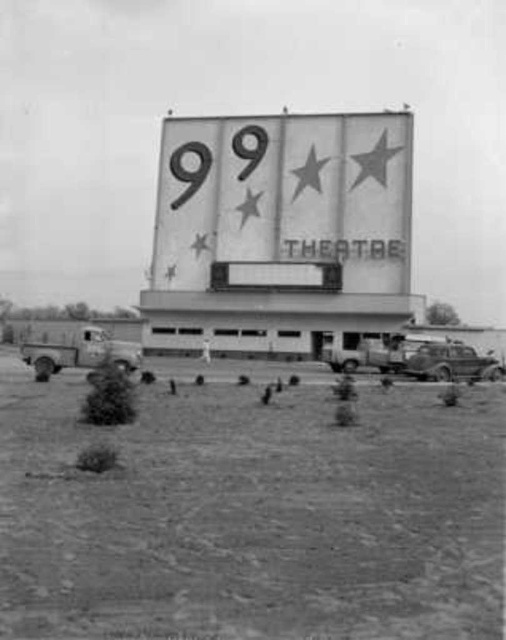
Question: Is dirt field at lower center bigger than shiny chrome sedan at right?

Choices:
 (A) no
 (B) yes

Answer: (B)

Question: Among these objects, which one is farthest from the camera?

Choices:
 (A) metallic silver sign at center
 (B) shiny chrome sedan at right

Answer: (A)

Question: Does metallic silver sign at center lie behind shiny chrome sedan at right?

Choices:
 (A) no
 (B) yes

Answer: (B)

Question: Based on their relative distances, which object is nearer to the shiny chrome sedan at right?

Choices:
 (A) dirt field at lower center
 (B) metallic silver sign at center

Answer: (A)

Question: Which object is closer to the camera taking this photo?

Choices:
 (A) dirt field at lower center
 (B) metallic silver sign at center

Answer: (A)

Question: Does dirt field at lower center appear on the left side of metallic silver sign at center?

Choices:
 (A) no
 (B) yes

Answer: (A)